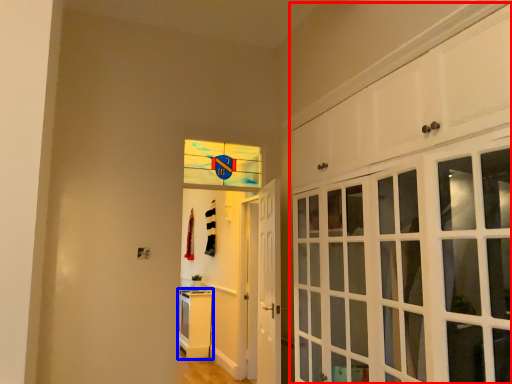
Question: Which object is further to the camera taking this photo, cabinetry (highlighted by a red box) or cabinetry (highlighted by a blue box)?

Choices:
 (A) cabinetry
 (B) cabinetry

Answer: (B)